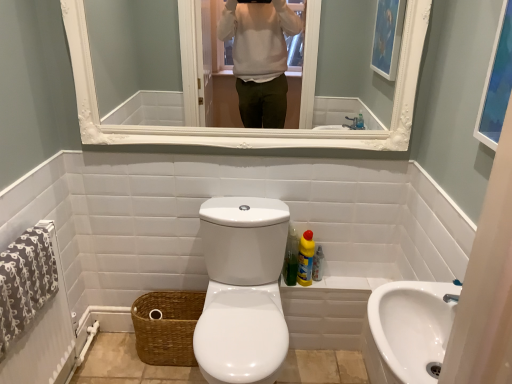
I want to click on spots to the right of translucent plastic bottle at lower right, so click(342, 274).